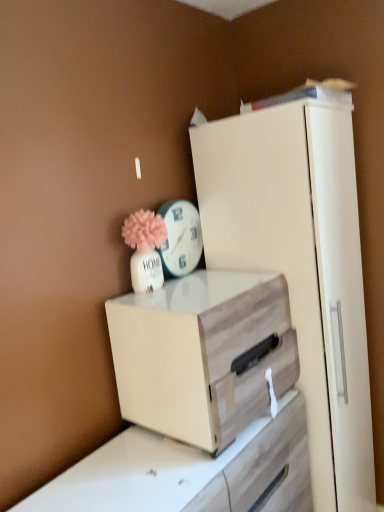
Question: Is wooden chest of drawers at center at the left side of white glossy clock at upper center?

Choices:
 (A) no
 (B) yes

Answer: (A)

Question: Is the position of wooden chest of drawers at center less distant than that of white glossy clock at upper center?

Choices:
 (A) yes
 (B) no

Answer: (A)

Question: Is wooden chest of drawers at center taller than white glossy clock at upper center?

Choices:
 (A) yes
 (B) no

Answer: (A)

Question: Is wooden chest of drawers at center at the right side of white glossy clock at upper center?

Choices:
 (A) no
 (B) yes

Answer: (B)

Question: From the image's perspective, would you say wooden chest of drawers at center is shown under white glossy clock at upper center?

Choices:
 (A) no
 (B) yes

Answer: (B)

Question: From a real-world perspective, does wooden chest of drawers at center stand above white glossy clock at upper center?

Choices:
 (A) yes
 (B) no

Answer: (B)

Question: Is white glossy clock at upper center facing away from wooden chest of drawers at center?

Choices:
 (A) no
 (B) yes

Answer: (A)

Question: Does white glossy clock at upper center appear on the right side of wooden chest of drawers at center?

Choices:
 (A) yes
 (B) no

Answer: (B)

Question: Does white glossy clock at upper center have a greater width compared to wooden chest of drawers at center?

Choices:
 (A) yes
 (B) no

Answer: (B)

Question: From the image's perspective, would you say white glossy clock at upper center is shown under wooden chest of drawers at center?

Choices:
 (A) no
 (B) yes

Answer: (A)

Question: Does white glossy clock at upper center have a greater height compared to wooden chest of drawers at center?

Choices:
 (A) no
 (B) yes

Answer: (A)

Question: From a real-world perspective, is white glossy clock at upper center positioned under wooden chest of drawers at center based on gravity?

Choices:
 (A) yes
 (B) no

Answer: (B)

Question: Which is correct: wooden chest of drawers at center is inside white glossy clock at upper center, or outside of it?

Choices:
 (A) outside
 (B) inside

Answer: (A)